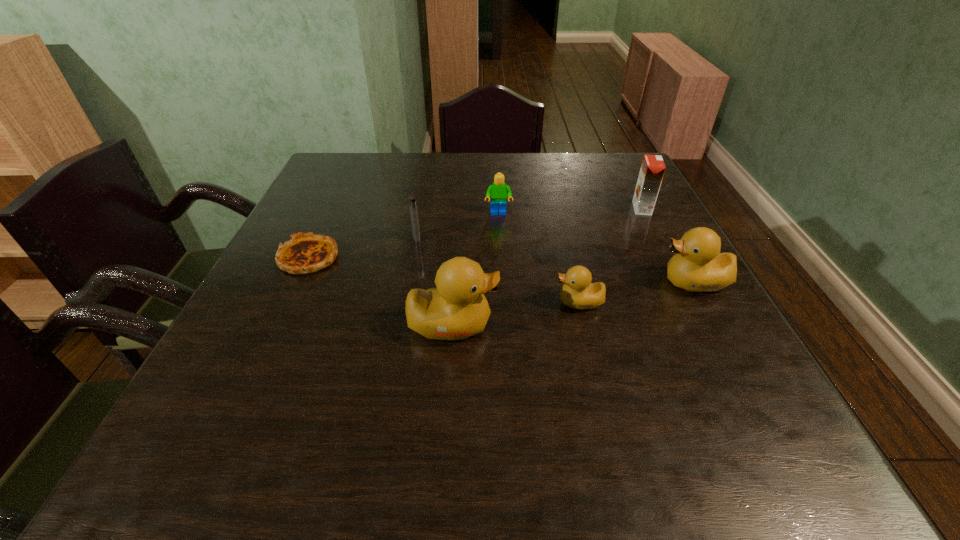
At what (x,y) coordinates should I click in order to perform the action: click on the leftmost duckling. Please return your answer as a coordinate pair (x, y). The height and width of the screenshot is (540, 960). Looking at the image, I should click on (457, 309).

Identify the location of the shortest duckling. (578, 292).

The height and width of the screenshot is (540, 960). Find the location of `the fifth object from left to right`. the fifth object from left to right is located at coordinates (578, 292).

Where is `the second tallest duckling`? the second tallest duckling is located at coordinates (698, 266).

At what (x,y) coordinates should I click in order to perform the action: click on the leftmost object. Please return your answer as a coordinate pair (x, y). The width and height of the screenshot is (960, 540). Looking at the image, I should click on (305, 253).

Identify the location of quiche. (305, 253).

This screenshot has height=540, width=960. I want to click on Lego, so click(x=498, y=192).

Where is `orange juice`? The height and width of the screenshot is (540, 960). orange juice is located at coordinates (652, 169).

This screenshot has height=540, width=960. I want to click on igniter, so click(x=412, y=200).

Identify the location of free spot located 0.110m facing forward on the leftmost duckling. (555, 325).